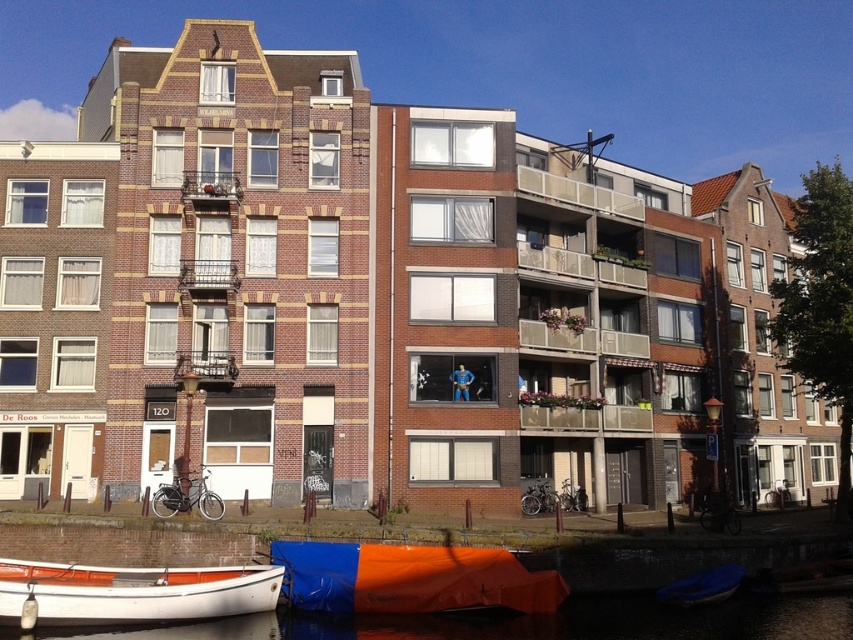
You are a tourist standing on the canal side and want to take a photo of the white glossy boat at lower left and the smooth dark water at lower center. Which object should you focus on first if you want to capture both in one frame without moving your camera?

You should focus on the white glossy boat at lower left first because it is on the left side, and the smooth dark water at lower center is to its right, so capturing the boat first allows the water to be included in the same frame without moving the camera.

You are standing at the point marked by the coordinates point (701,586) in the image. Looking around, you see a blue fabric boat at lower center. What object is located at your current position?

The point (701,586) corresponds to the blue fabric boat at lower center.